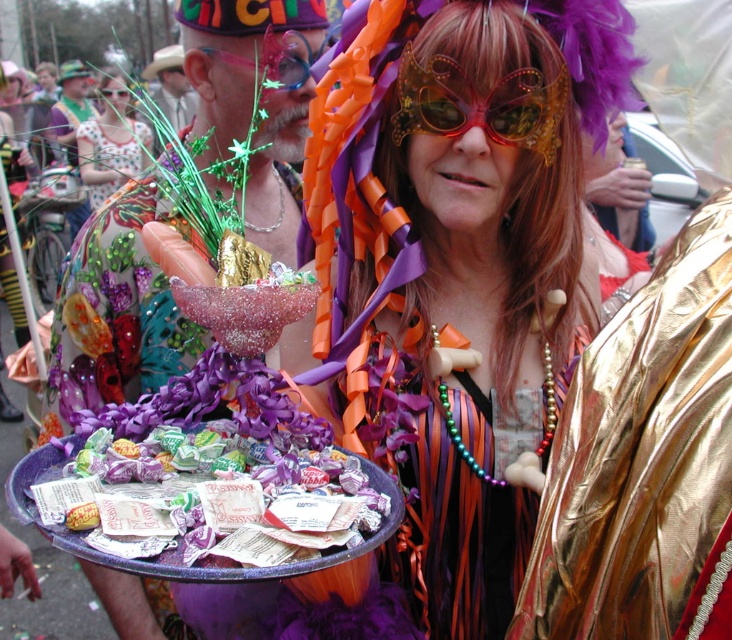
Question: Which is farther from the metallic gold goggles at center?

Choices:
 (A) matte gold cowboy hat at upper left
 (B) purple glossy tray at center

Answer: (B)

Question: Estimate the real-world distances between objects in this image. Which object is closer to the matte gold cowboy hat at upper left?

Choices:
 (A) brushed metal hat at upper left
 (B) purple glossy tray at center
 (C) metallic gold goggles at center

Answer: (C)

Question: Can you confirm if shiny metallic tray at center is positioned below purple glossy tray at center?

Choices:
 (A) no
 (B) yes

Answer: (A)

Question: Observing the image, what is the correct spatial positioning of gold textured goggles at center in reference to polka dot fabric dress at upper left?

Choices:
 (A) above
 (B) below

Answer: (B)

Question: Considering the relative positions of polka dot fabric dress at upper left and metallic gold goggles at center in the image provided, where is polka dot fabric dress at upper left located with respect to metallic gold goggles at center?

Choices:
 (A) above
 (B) below

Answer: (B)

Question: Which object is farther from the camera taking this photo?

Choices:
 (A) polka dot fabric dress at upper left
 (B) matte gold cowboy hat at upper left
 (C) brushed metal hat at upper left
 (D) metallic gold goggles at center

Answer: (D)